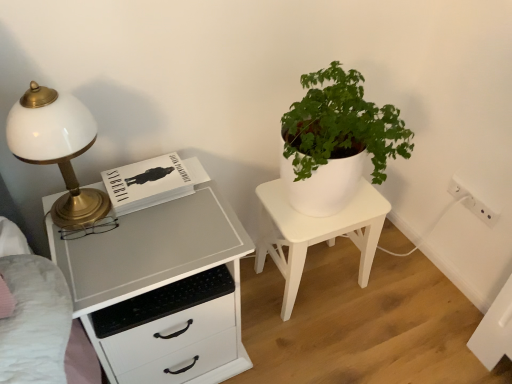
I want to click on vacant space in front of white matte/porcelain nightstand at center, so click(x=329, y=342).